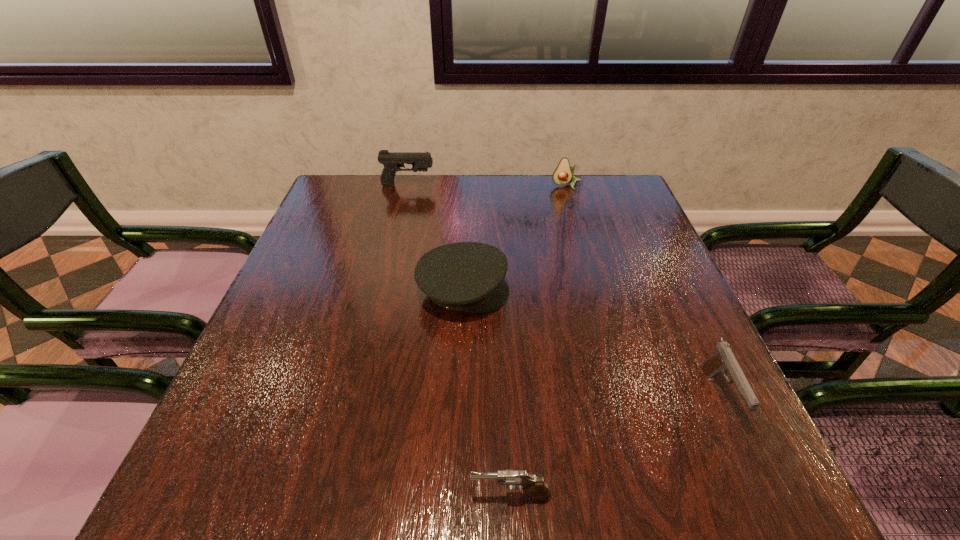
At what (x,y) coordinates should I click in order to perform the action: click on free space located on the front-facing side of the third farthest object. Please return your answer as a coordinate pair (x, y). Looking at the image, I should click on tap(651, 292).

At what (x,y) coordinates should I click in order to perform the action: click on blank space located 0.090m at the barrel of the rightmost pistol. Please return your answer as a coordinate pair (x, y). This screenshot has height=540, width=960. Looking at the image, I should click on (761, 488).

Image resolution: width=960 pixels, height=540 pixels. What are the coordinates of `vacant space located 0.240m at the barrel of the second pistol from right to left` in the screenshot? It's located at (313, 496).

Locate an element on the screen. The height and width of the screenshot is (540, 960). vacant region located at the barrel of the second pistol from right to left is located at coordinates 378,496.

At what (x,y) coordinates should I click in order to perform the action: click on free space located at the barrel of the second pistol from right to left. Please return your answer as a coordinate pair (x, y). The width and height of the screenshot is (960, 540). Looking at the image, I should click on (300, 496).

Where is `pistol present at the far edge`? pistol present at the far edge is located at coordinates (392, 161).

Locate an element on the screen. The height and width of the screenshot is (540, 960). avocado present at the far edge is located at coordinates (563, 174).

Locate an element on the screen. object that is positioned at the near edge is located at coordinates (514, 479).

Locate an element on the screen. The image size is (960, 540). object at the left edge is located at coordinates (392, 161).

The image size is (960, 540). Find the location of `avocado that is positioned at the right edge`. avocado that is positioned at the right edge is located at coordinates (563, 174).